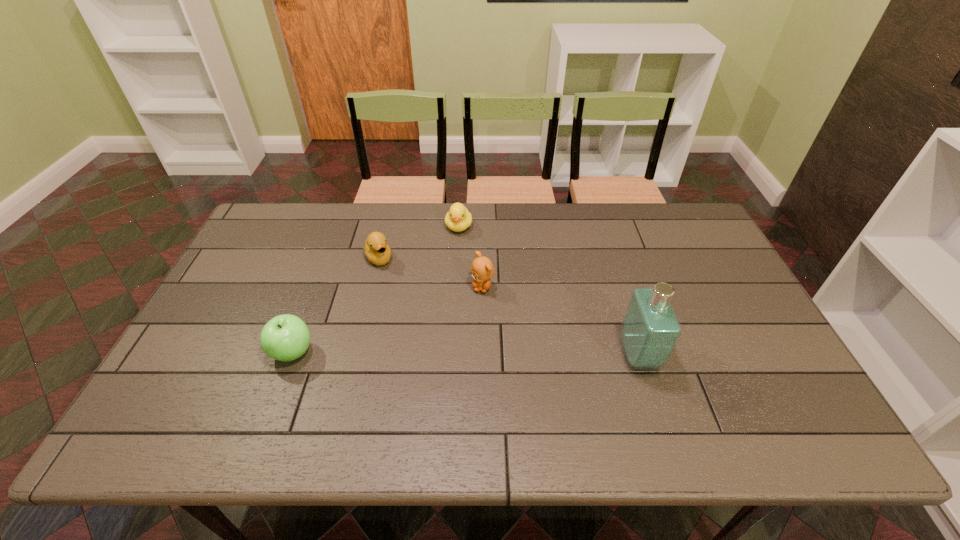
The width and height of the screenshot is (960, 540). What are the coordinates of `vacant space on the desktop that is between the apple and the perfume and is positioned on the beak of the right duckling` in the screenshot? It's located at click(x=439, y=354).

Identify the location of free space on the desktop that is between the leftmost object and the perfume and is positioned on the face of the third farthest object. The height and width of the screenshot is (540, 960). (461, 354).

The image size is (960, 540). What are the coordinates of `free space on the desktop that is between the leftmost object and the rightmost object and is positioned facing forward on the second object from left to right` in the screenshot? It's located at (438, 354).